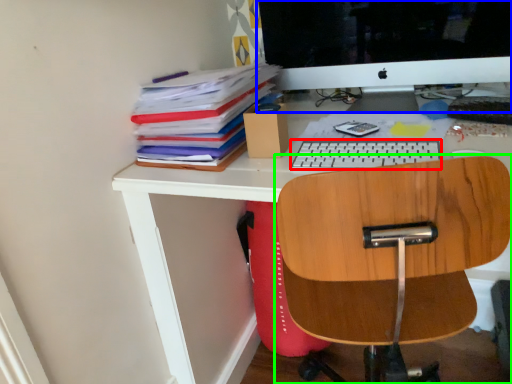
Question: Considering the real-world distances, which object is farthest from keyboard (highlighted by a red box)? computer monitor (highlighted by a blue box) or chair (highlighted by a green box)?

Choices:
 (A) computer monitor
 (B) chair

Answer: (A)